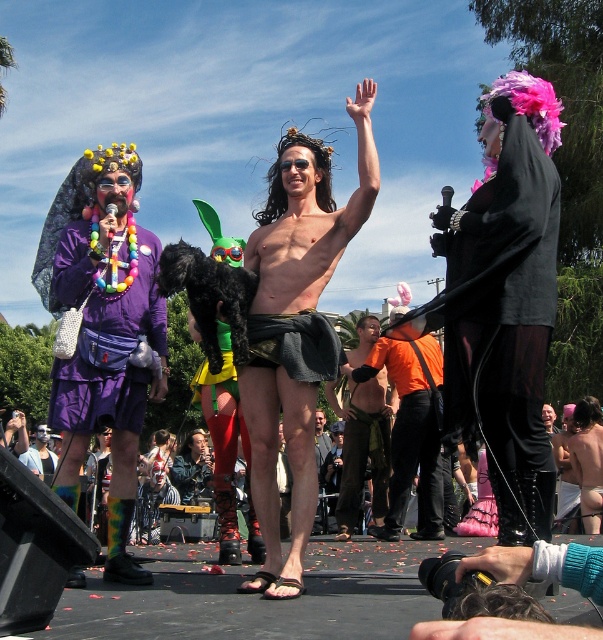
Question: Estimate the real-world distances between objects in this image. Which object is farther from the matte purple dress at left?

Choices:
 (A) natural hair wig at center
 (B) purple fabric purse at left
 (C) orange fabric shorts at center
 (D) black leather gloves at right

Answer: (D)

Question: Is matte purple dress at left to the left of orange fabric shorts at center from the viewer's perspective?

Choices:
 (A) no
 (B) yes

Answer: (B)

Question: Which of the following is the farthest from the observer?

Choices:
 (A) (121, 390)
 (B) (103, 326)

Answer: (B)

Question: Is black leather gloves at right wider than natural hair wig at center?

Choices:
 (A) no
 (B) yes

Answer: (A)

Question: Does orange matte shirt at center have a smaller size compared to natural hair wig at center?

Choices:
 (A) yes
 (B) no

Answer: (A)

Question: Which object is the closest to the orange fabric shorts at center?

Choices:
 (A) black leather gloves at right
 (B) purple fabric purse at left

Answer: (A)